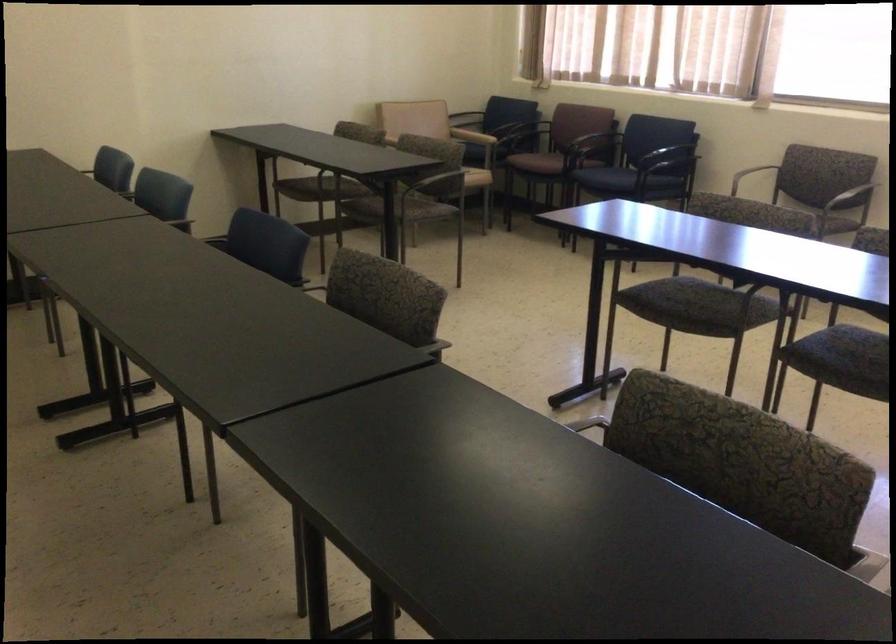
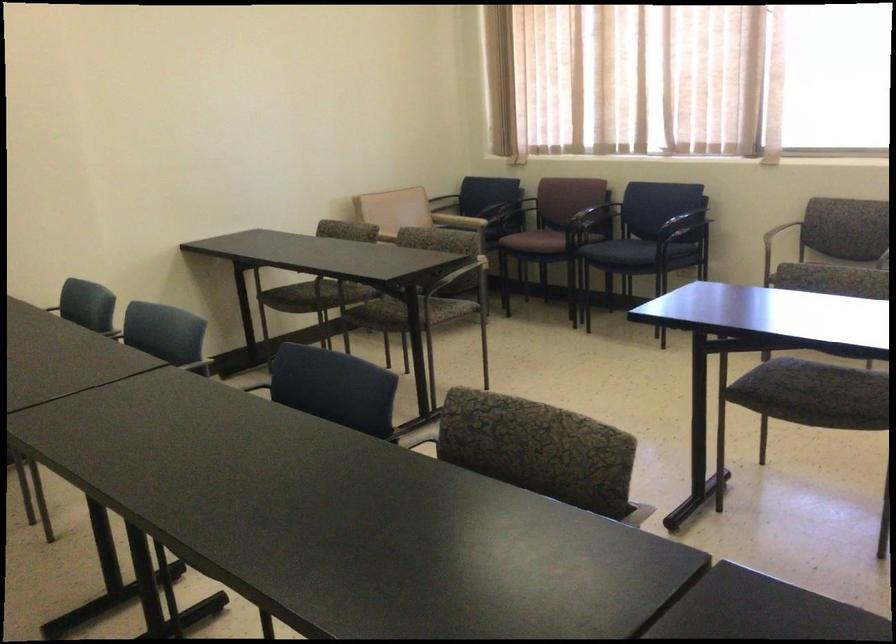
In a continuous first-person perspective shot, in which direction is the camera moving?

The cameraman walked toward left, forward.